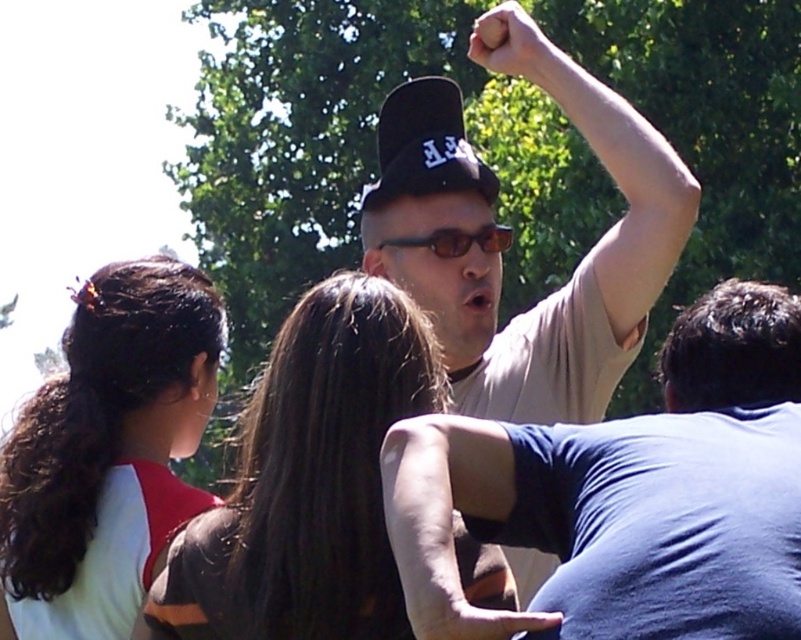
Based on the scene description, can you determine which object is positioned higher between the smooth skin arm at center and the smooth skin hand at upper center?

The smooth skin arm at center is above the smooth skin hand at upper center.

You are a photographer trying to capture a closeup of the smooth skin arm at center and the smooth skin hand at upper center. Which object should you zoom in on to ensure they both fit in the frame without cropping?

The smooth skin hand at upper center has a smaller width than the smooth skin arm at center. To ensure both fit in the frame without cropping, you should zoom out slightly so that the wider smooth skin arm at center is fully visible, allowing the narrower smooth skin hand at upper center to also fit within the frame.